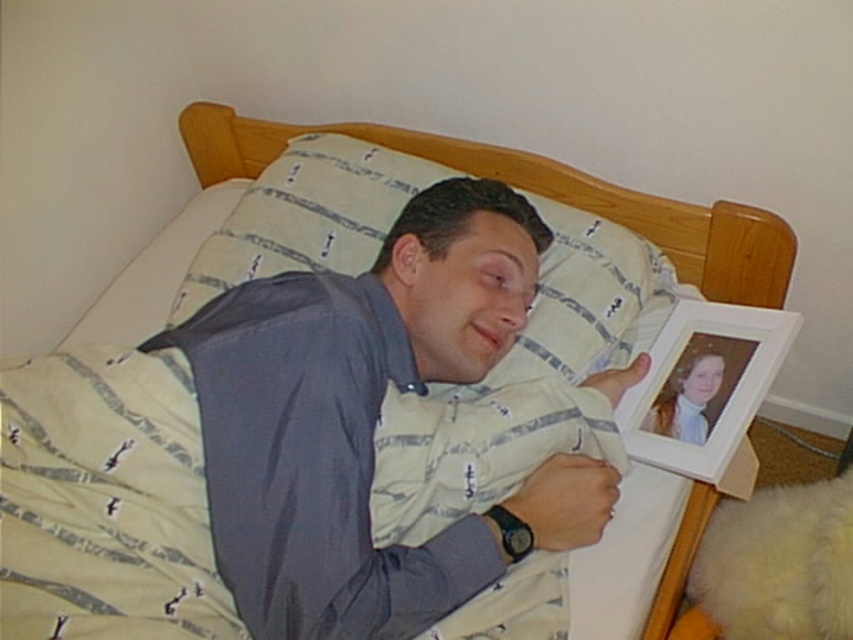
The width and height of the screenshot is (853, 640). Find the location of `white striped pillow at upper center`. white striped pillow at upper center is located at coordinates (306, 216).

Does white striped pillow at upper center have a greater height compared to white matte picture frame at upper right?

Correct, white striped pillow at upper center is much taller as white matte picture frame at upper right.

This screenshot has width=853, height=640. Describe the element at coordinates (306, 216) in the screenshot. I see `white striped pillow at upper center` at that location.

The height and width of the screenshot is (640, 853). Identify the location of white striped pillow at upper center. (306, 216).

Does white striped pillow at upper center have a lesser width compared to white fluffy teddy at lower right?

In fact, white striped pillow at upper center might be wider than white fluffy teddy at lower right.

Which is more to the left, white striped pillow at upper center or white fluffy teddy at lower right?

white striped pillow at upper center is more to the left.

Is point (215, 250) closer to camera compared to point (769, 586)?

No, (215, 250) is further to viewer.

Where is `white striped pillow at upper center`? white striped pillow at upper center is located at coordinates (306, 216).

Is white fluffy teddy at lower right bigger than white matte picture frame at upper right?

Correct, white fluffy teddy at lower right is larger in size than white matte picture frame at upper right.

Is point (746, 534) behind point (689, 365)?

No, it is not.

In order to click on white fluffy teddy at lower right in this screenshot , I will do [x=778, y=563].

The image size is (853, 640). Find the location of `white fluffy teddy at lower right`. white fluffy teddy at lower right is located at coordinates (778, 563).